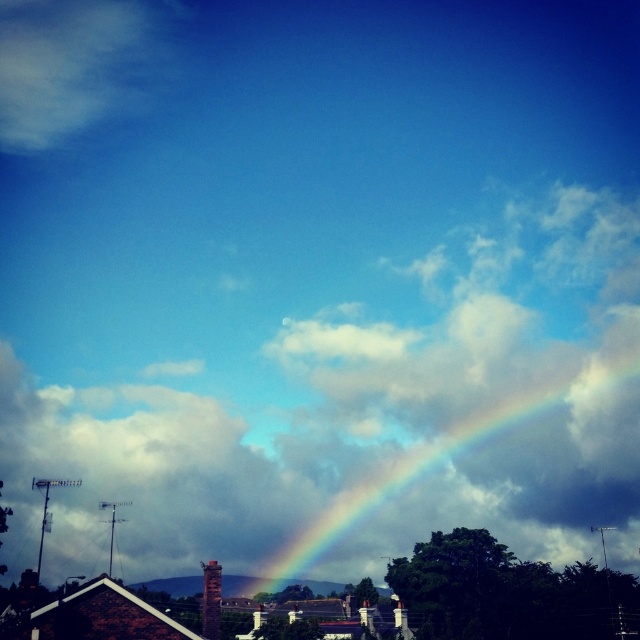
You are an architect designing a new observatory. You want to ensure the dome has a clear view of the cloudy sky at upper center and the white fluffy cloud at upper left. Which object will require a larger observation window to fully view?

The cloudy sky at upper center requires a larger observation window because it is larger in size than the white fluffy cloud at upper left.

You are an artist trying to paint the scene. You notice the white fluffy cloud at upper left and the rainbow at center. Which one do you think you need to make wider to match the actual size?

The white fluffy cloud at upper left has a lesser width compared to the rainbow at center, so you should make the white fluffy cloud at upper left wider to match the actual size.

You are an astronomer analyzing the image of the sky scene. You need to locate the white fluffy cloud at upper left. What are its coordinates?

The white fluffy cloud at upper left is located at coordinates (76, 65).